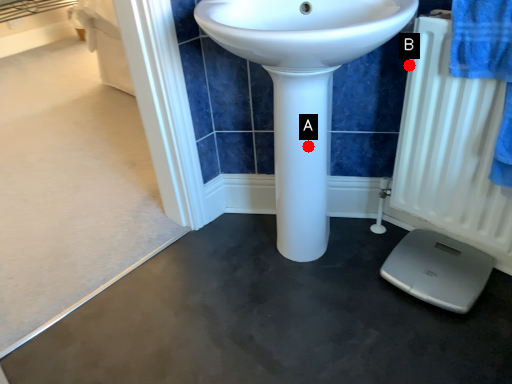
Question: Two points are circled on the image, labeled by A and B beside each circle. Which point is closer to the camera?

Choices:
 (A) A is closer
 (B) B is closer

Answer: (A)